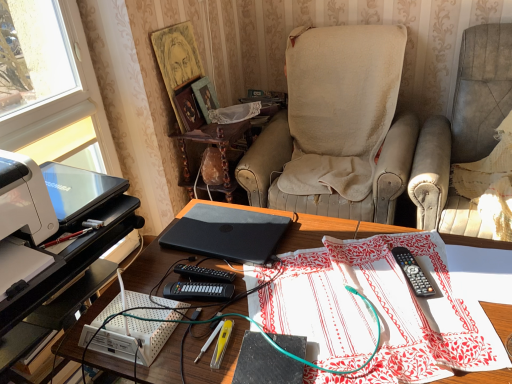
Locate an element on the screen. The width and height of the screenshot is (512, 384). vacant space that's between black plastic remote control at center, the 1th stationery from the right, and black plastic keyboard at center, acting as the 2th stationery starting from the right is located at coordinates (320, 285).